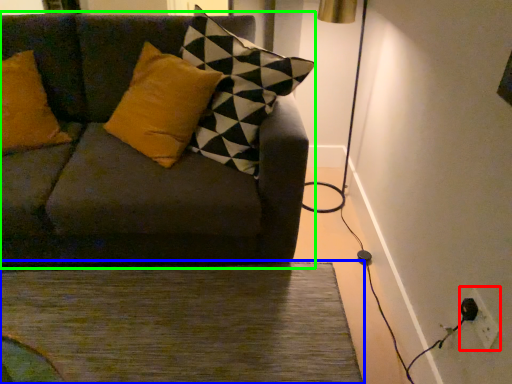
Question: Estimate the real-world distances between objects in this image. Which object is closer to electric outlet (highlighted by a red box), doormat (highlighted by a blue box) or studio couch (highlighted by a green box)?

Choices:
 (A) doormat
 (B) studio couch

Answer: (A)